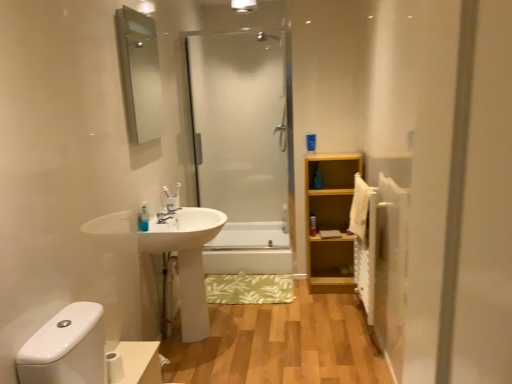
This screenshot has height=384, width=512. Identify the location of vacant space behind white matte toilet paper at lower left. (130, 353).